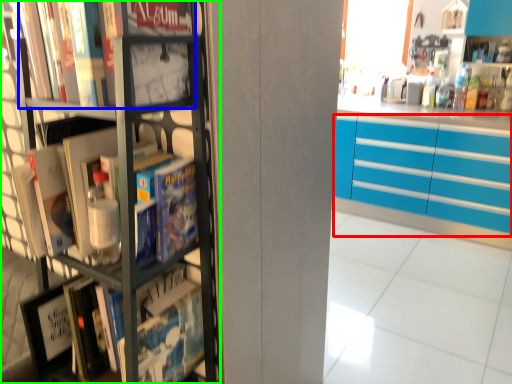
Question: Estimate the real-world distances between objects in this image. Which object is closer to cabinetry (highlighted by a red box), book (highlighted by a blue box) or bookcase (highlighted by a green box)?

Choices:
 (A) book
 (B) bookcase

Answer: (B)